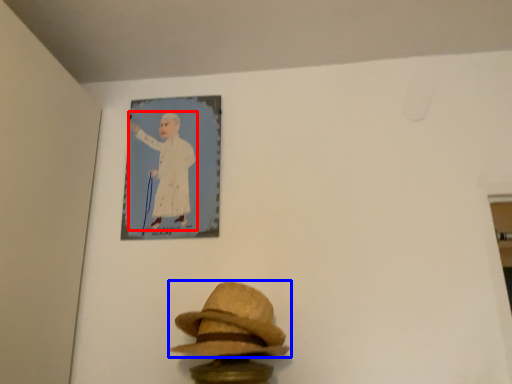
Question: Among these objects, which one is nearest to the camera, person (highlighted by a red box) or fedora (highlighted by a blue box)?

Choices:
 (A) person
 (B) fedora

Answer: (B)